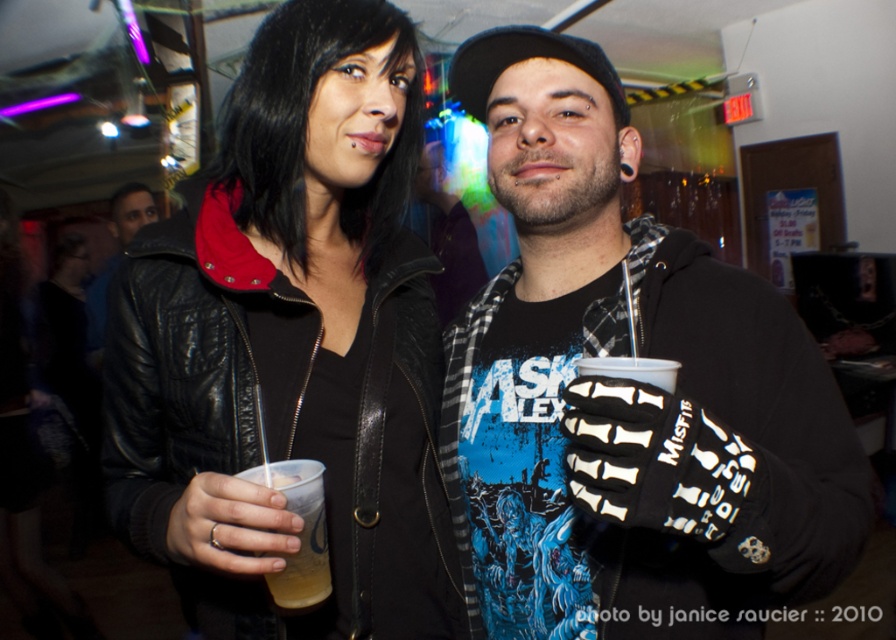
Which is below, black matte glove at center or matte black leather jacket at center?

black matte glove at center is lower down.

Is black matte glove at center shorter than matte black leather jacket at center?

Indeed, black matte glove at center has a lesser height compared to matte black leather jacket at center.

What do you see at coordinates (627, 392) in the screenshot? I see `black matte glove at center` at bounding box center [627, 392].

This screenshot has width=896, height=640. I want to click on black matte glove at center, so click(x=627, y=392).

Does black matte glove at center appear under translucent plastic cup at center?

No.

Which is above, black matte glove at center or translucent plastic cup at center?

black matte glove at center

Is point (781, 570) positioned before point (309, 529)?

Yes, point (781, 570) is in front of point (309, 529).

The width and height of the screenshot is (896, 640). What are the coordinates of `black matte glove at center` in the screenshot? It's located at (627, 392).

Which is more to the left, matte black leather jacket at center or translucent plastic cup at center?

From the viewer's perspective, matte black leather jacket at center appears more on the left side.

Does point (128, 454) lie behind point (300, 589)?

Yes, point (128, 454) is farther from viewer.

Is point (416, 67) farther from camera compared to point (269, 579)?

Yes, it is.

I want to click on matte black leather jacket at center, so click(291, 342).